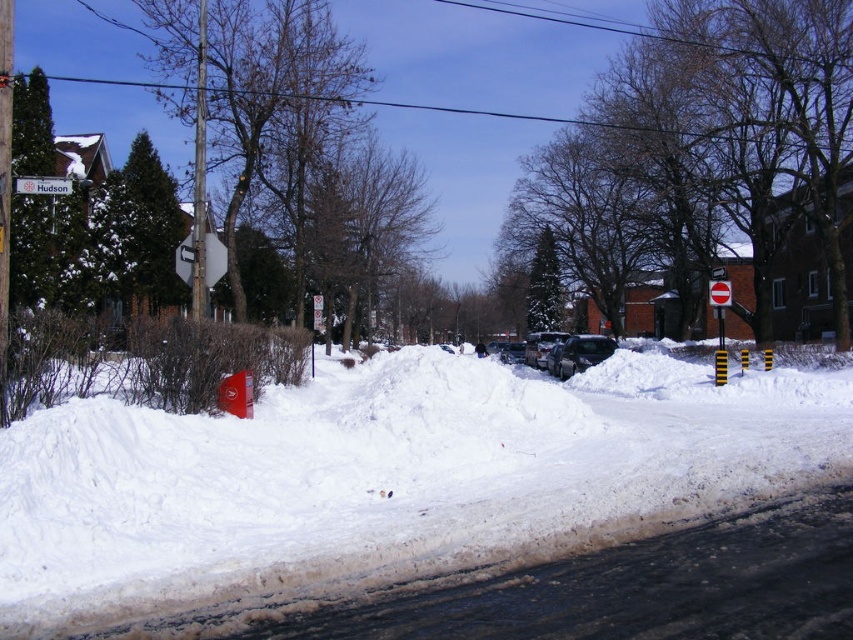
You are a delivery driver trying to park your 2.5 meters wide truck in the space between the sleek black car at center and the white plastic street sign at upper left. Based on the scene, can your truck fit there?

The sleek black car at center is wider than the white plastic street sign at upper left. However, the exact width of the space between them is not provided in the scene description, so it is uncertain if the truck can fit.

You are a delivery driver who needs to park your car near the white plastic street sign at upper left. The parking spot must be on the right side of the sign. Is the sleek black car at center currently occupying that spot?

The sleek black car at center is positioned on the right side of the white plastic street sign at upper left, so it is occupying the parking spot you need.